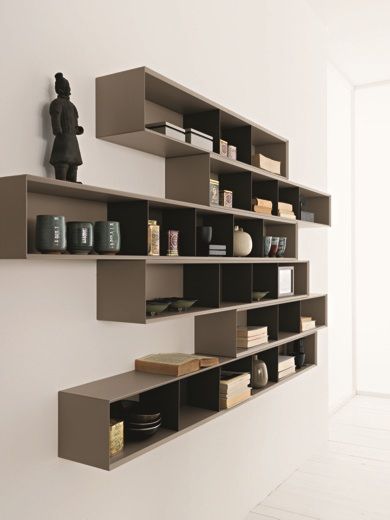
Locate an element on the screen. This screenshot has height=520, width=390. ceramic cup is located at coordinates (53, 232), (80, 236), (107, 236), (302, 357).